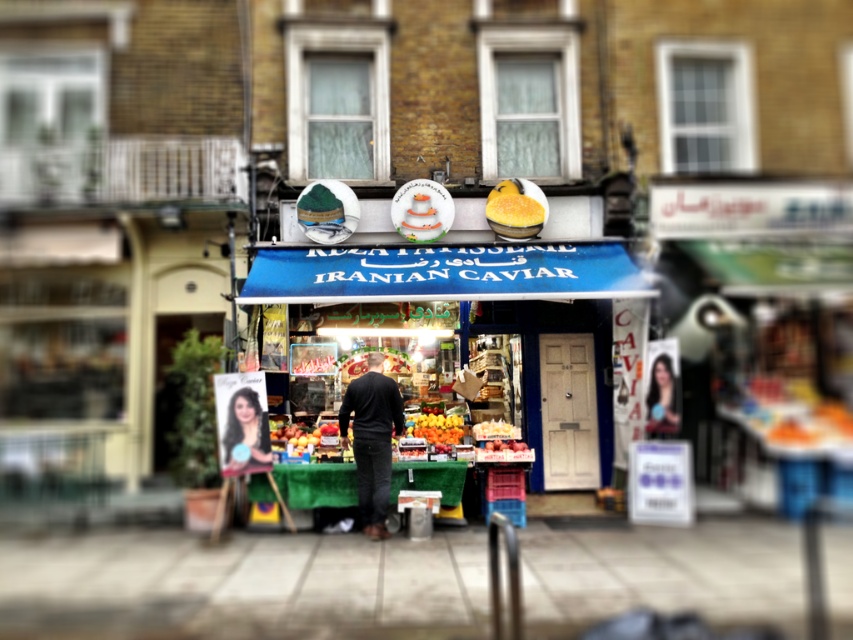
Between point (225, 432) and point (434, 422), which one is positioned behind?

The point (434, 422) is more distant.

Does smooth skin portrait at lower left appear on the left side of orange matte at center?

A: Correct, you'll find smooth skin portrait at lower left to the left of orange matte at center.

Is point (254, 432) farther from viewer compared to point (436, 428)?

No, it is in front of (436, 428).

Locate an element on the screen. Image resolution: width=853 pixels, height=640 pixels. smooth skin portrait at lower left is located at coordinates (245, 433).

Can you confirm if black matte jacket at center is positioned to the left of yellow matte cake at center?

Correct, you'll find black matte jacket at center to the left of yellow matte cake at center.

Between point (387, 476) and point (498, 428), which one is positioned in front?

Point (387, 476) is in front.

The image size is (853, 640). I want to click on black matte jacket at center, so click(x=372, y=440).

Can you confirm if black matte jacket at center is bigger than smooth black hair at center?

Indeed, black matte jacket at center has a larger size compared to smooth black hair at center.

Is black matte jacket at center to the left of smooth black hair at center from the viewer's perspective?

Correct, you'll find black matte jacket at center to the left of smooth black hair at center.

Who is more forward, (386, 509) or (675, 420)?

Point (386, 509) is in front.

Where is `black matte jacket at center`? The width and height of the screenshot is (853, 640). black matte jacket at center is located at coordinates (372, 440).